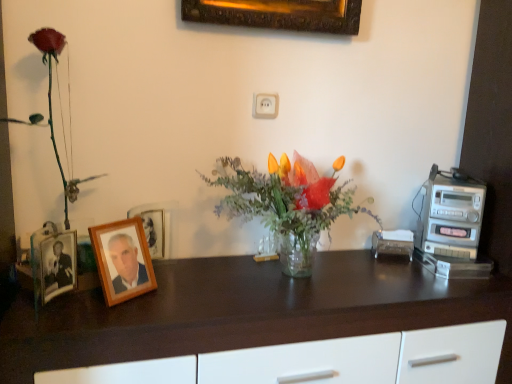
Find the location of a particular element. The width and height of the screenshot is (512, 384). blank space situated above silver metallic stereo at right (from a real-world perspective) is located at coordinates (455, 179).